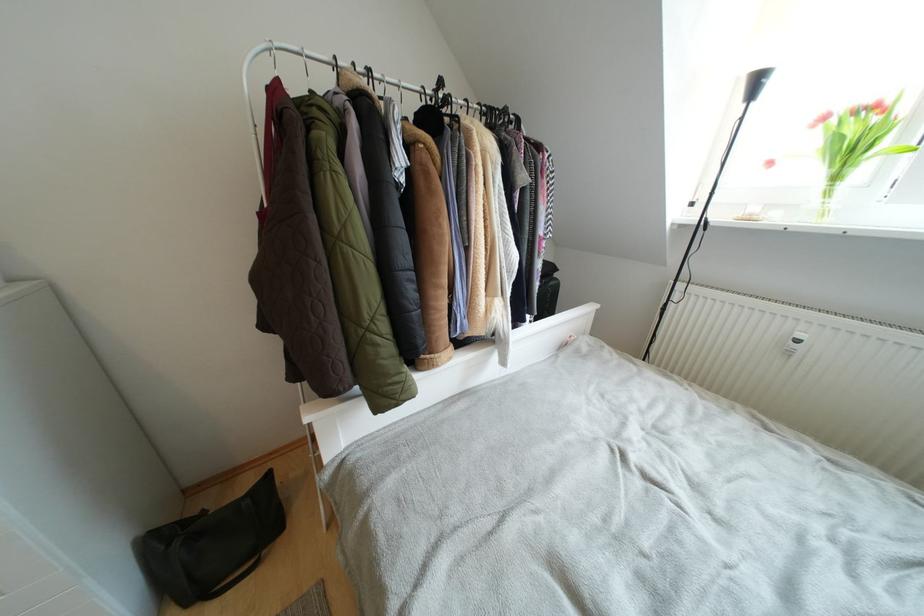
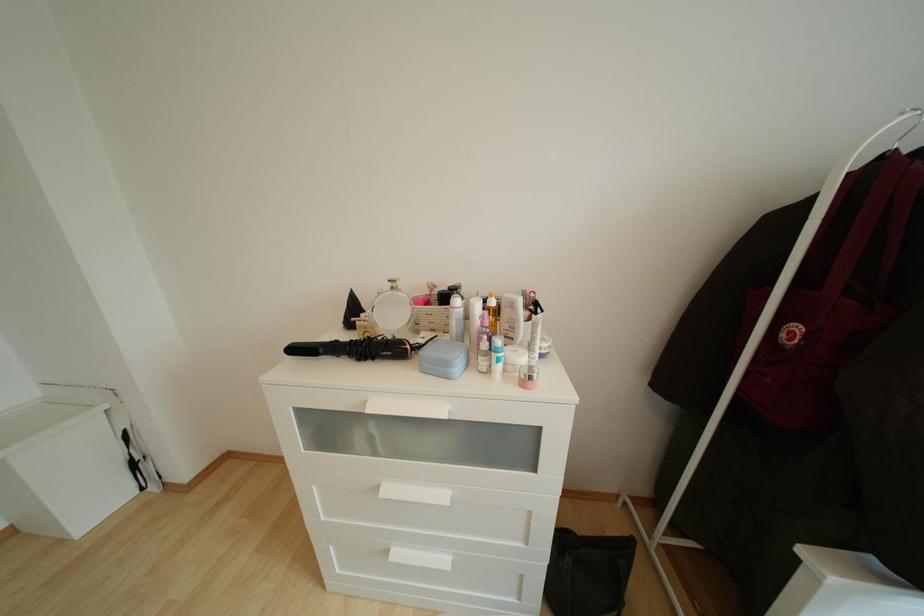
Question: The camera is either moving clockwise (left) or counter-clockwise (right) around the object. The first image is from the beginning of the video and the second image is from the end. Is the camera moving left or right when shooting the video?

Choices:
 (A) Left
 (B) Right

Answer: (B)